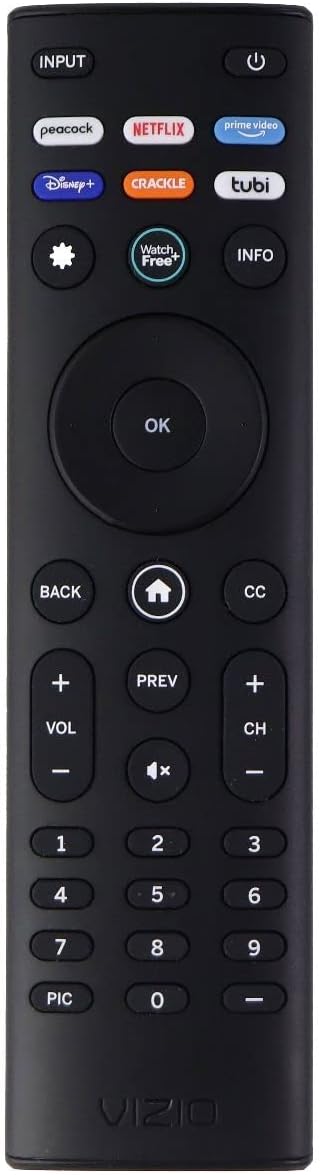
The width and height of the screenshot is (320, 1175). What are the coordinates of `0-9 buttons on remote` in the screenshot? It's located at (68, 846), (63, 889), (61, 947), (136, 991), (145, 956), (168, 888), (160, 833), (259, 841), (259, 878), (249, 940).